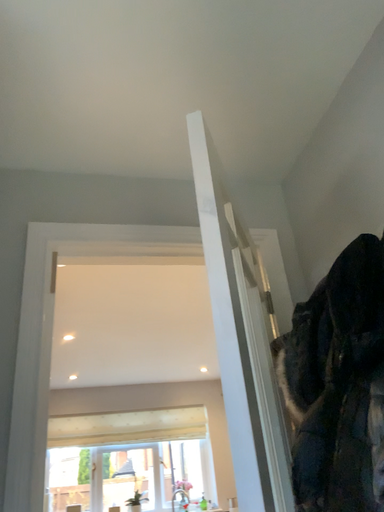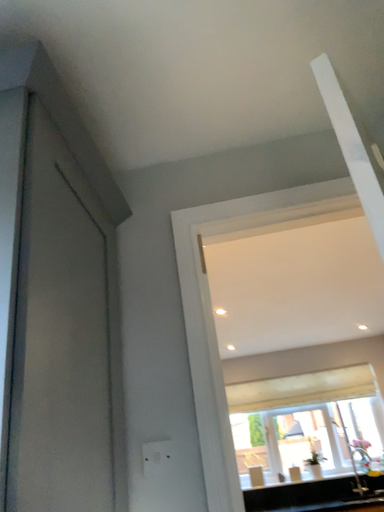
Question: Which way did the camera rotate in the video?

Choices:
 (A) rotated left
 (B) rotated right

Answer: (A)